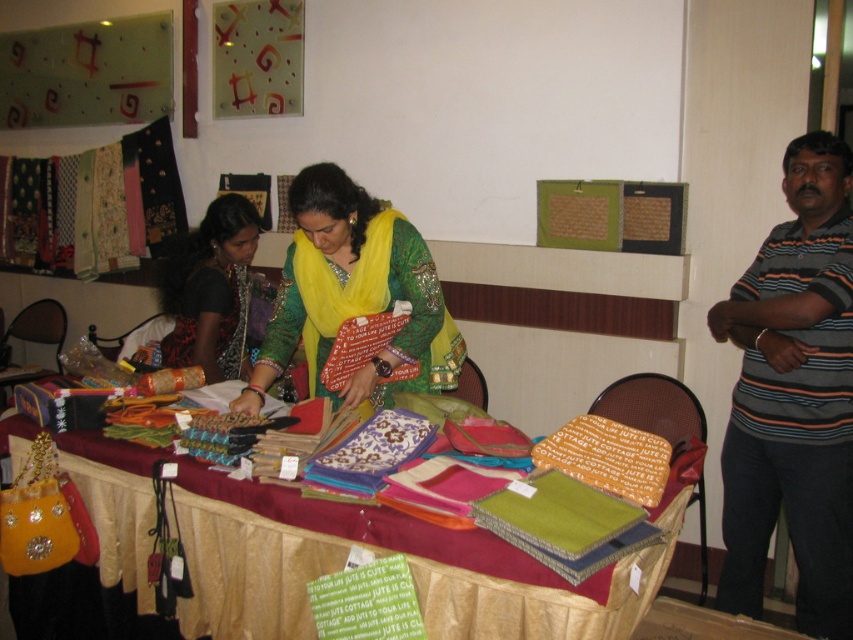
You are a customer in the shop and want to pick up both the textured fabric at center and the matte black blouse at center. Can you reach both items without moving your position? Explain your reasoning.

The distance between the textured fabric at center and the matte black blouse at center is 34.15 inches. If your arms can span at least 34.15 inches, you can reach both items without moving. Otherwise, you might need to adjust your position.

You are standing at the entrance of the shop and see two points marked in the scene. Which point, point (813, 628) or point (432, 305), is closer to you?

Point (432, 305) is closer to you because it is in front of point (813, 628).

You are a customer in the shop and want to touch the textured fabric at center. Where should you go to reach it?

The textured fabric at center is located at point 0.864 on the x axis and 0.455 on the y axis, so you should go to that coordinate to reach it.